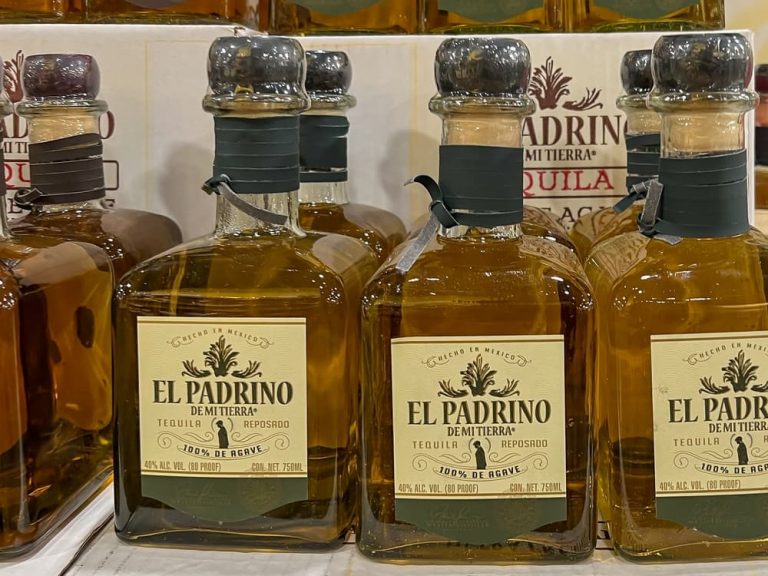
Identify the location of edge of white tray on tabletop. The image size is (768, 576). (65, 537).